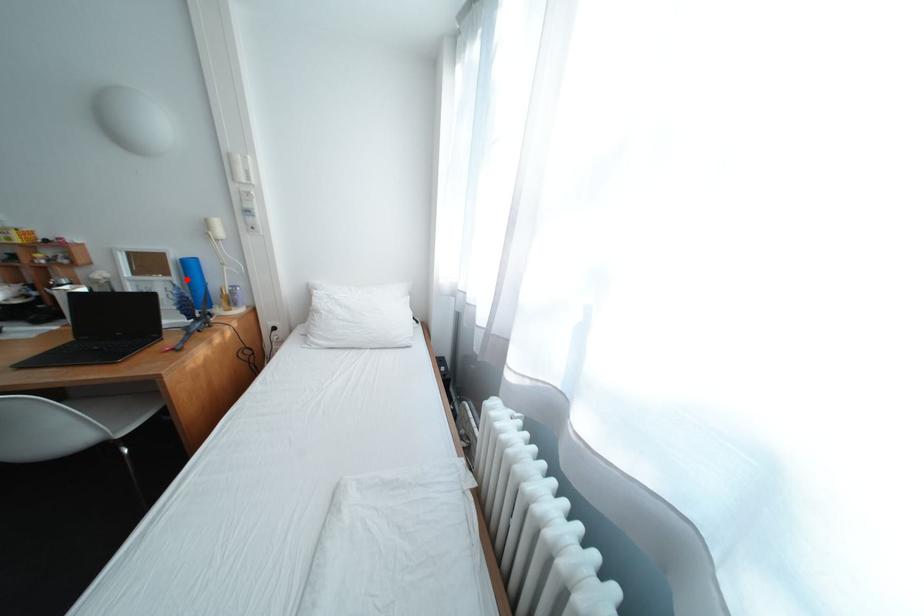
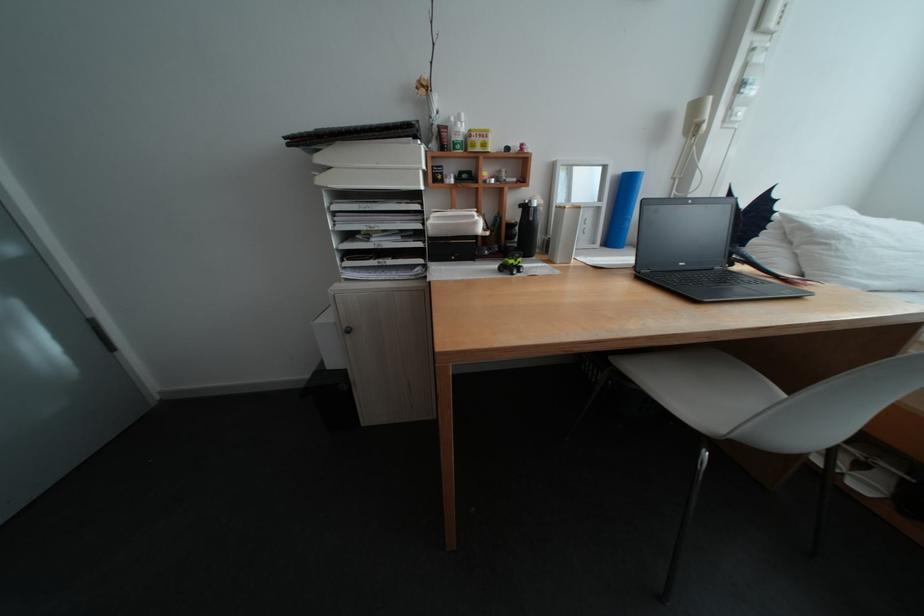
The point at the highlighted location is marked in the first image. Where is the corresponding point in the second image?

(616, 205)